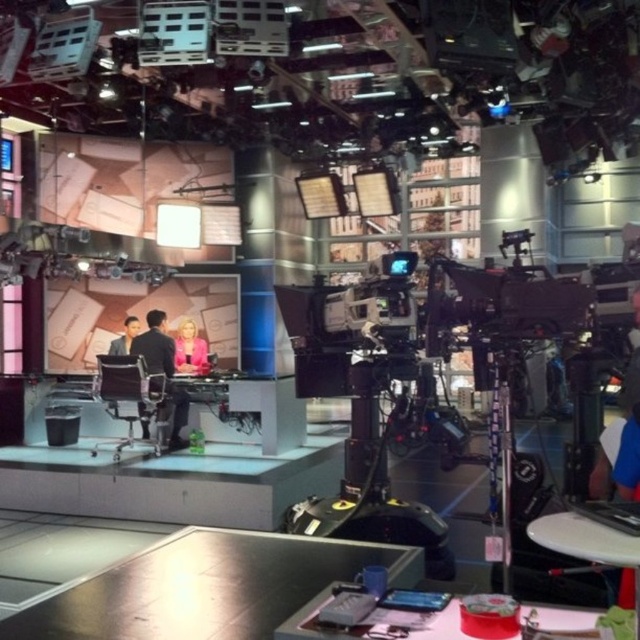
Between pink fabric at center and matte black suit at left, which one appears on the right side from the viewer's perspective?

pink fabric at center is more to the right.

Between point (192, 365) and point (131, 340), which one is positioned in front?

Point (131, 340) is in front.

Find the location of a particular element. This screenshot has height=640, width=640. pink fabric at center is located at coordinates (189, 349).

Is dark suit at center bigger than matte black suit at left?

Yes, dark suit at center is bigger than matte black suit at left.

Is point (168, 358) farther from camera compared to point (122, 342)?

No.

Who is more distant from viewer, (x=180, y=417) or (x=138, y=328)?

Point (x=138, y=328)

Image resolution: width=640 pixels, height=640 pixels. Identify the location of dark suit at center. (156, 346).

Does dark suit at center have a greater height compared to pink fabric at center?

Yes, dark suit at center is taller than pink fabric at center.

Can you confirm if dark suit at center is positioned to the right of pink fabric at center?

No, dark suit at center is not to the right of pink fabric at center.

The width and height of the screenshot is (640, 640). Describe the element at coordinates (156, 346) in the screenshot. I see `dark suit at center` at that location.

Identify the location of dark suit at center. (156, 346).